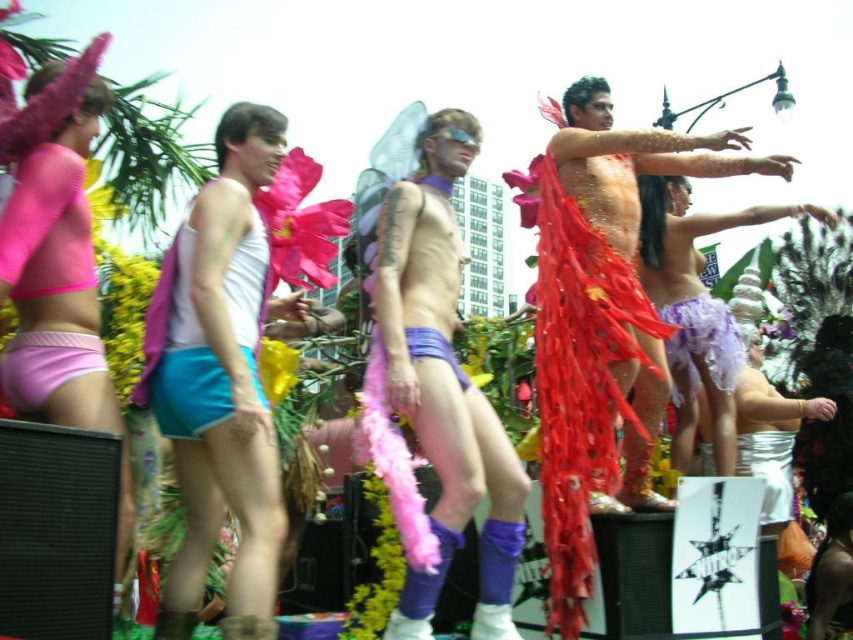
Question: Does shiny metallic man at center have a larger size compared to lavender tulle skirt at center?

Choices:
 (A) yes
 (B) no

Answer: (A)

Question: Which point appears farthest from the camera in this image?

Choices:
 (A) (386, 246)
 (B) (677, 148)
 (C) (27, 348)
 (D) (49, 148)

Answer: (B)

Question: Which point is closer to the camera?

Choices:
 (A) (723, 330)
 (B) (697, 173)
 (C) (207, 273)
 (D) (521, 534)

Answer: (D)

Question: Considering the relative positions of teal fabric shorts at center and pink fabric underwear at lower left in the image provided, where is teal fabric shorts at center located with respect to pink fabric underwear at lower left?

Choices:
 (A) above
 (B) below

Answer: (A)

Question: Can you confirm if matte teal shorts at center is bigger than matte purple tulle skirt at right?

Choices:
 (A) no
 (B) yes

Answer: (B)

Question: Among these objects, which one is nearest to the camera?

Choices:
 (A) pink fabric underwear at lower left
 (B) matte teal shorts at center
 (C) lavender tulle skirt at center

Answer: (B)